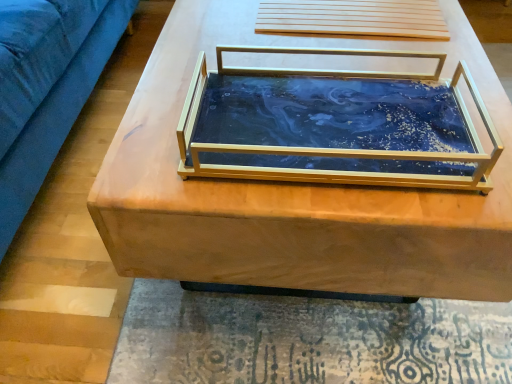
The width and height of the screenshot is (512, 384). Describe the element at coordinates (334, 125) in the screenshot. I see `marble-like blue tray at center` at that location.

Locate an element on the screen. The height and width of the screenshot is (384, 512). marble-like blue tray at center is located at coordinates (334, 125).

What do you see at coordinates (295, 190) in the screenshot?
I see `wooden table at center` at bounding box center [295, 190].

I want to click on wooden table at center, so click(x=295, y=190).

I want to click on marble-like blue tray at center, so coord(334,125).

Is wooden table at center at the right side of marble-like blue tray at center?

Correct, you'll find wooden table at center to the right of marble-like blue tray at center.

Considering the relative positions of wooden table at center and marble-like blue tray at center in the image provided, is wooden table at center behind marble-like blue tray at center?

That is True.

Does point (368, 249) lie in front of point (423, 94)?

Yes, point (368, 249) is in front of point (423, 94).

From the image's perspective, who appears lower, wooden table at center or marble-like blue tray at center?

marble-like blue tray at center appears lower in the image.

From a real-world perspective, is wooden table at center above or below marble-like blue tray at center?

wooden table at center is below marble-like blue tray at center.

Which object is thinner, wooden table at center or marble-like blue tray at center?

Thinner between the two is marble-like blue tray at center.

Which of these two, wooden table at center or marble-like blue tray at center, stands shorter?

marble-like blue tray at center.

Which of these two, wooden table at center or marble-like blue tray at center, is smaller?

With smaller size is marble-like blue tray at center.

Is wooden table at center spatially inside marble-like blue tray at center, or outside of it?

wooden table at center is not inside marble-like blue tray at center, it's outside.

Would you say wooden table at center is a long distance from marble-like blue tray at center?

No.

Is wooden table at center oriented towards marble-like blue tray at center?

No.

How different are the orientations of wooden table at center and marble-like blue tray at center in degrees?

The angle between the facing direction of wooden table at center and the facing direction of marble-like blue tray at center is 0.0014 degrees.

Find the location of `table above the marble-like blue tray at center (from the image's perspective)`. table above the marble-like blue tray at center (from the image's perspective) is located at coordinates (295, 190).

Visually, is marble-like blue tray at center positioned to the left or to the right of wooden table at center?

marble-like blue tray at center is to the left of wooden table at center.

Is the depth of marble-like blue tray at center less than that of wooden table at center?

Yes, it is.

Which is closer to the camera, (322, 73) or (184, 223)?

The point (184, 223) is more forward.

From the image's perspective, which one is positioned lower, marble-like blue tray at center or wooden table at center?

marble-like blue tray at center, from the image's perspective.

From a real-world perspective, which object stands above the other?

marble-like blue tray at center.

Between marble-like blue tray at center and wooden table at center, which one has smaller width?

marble-like blue tray at center.

Who is shorter, marble-like blue tray at center or wooden table at center?

marble-like blue tray at center.

Can you confirm if marble-like blue tray at center is bigger than wooden table at center?

No, marble-like blue tray at center is not bigger than wooden table at center.

Would you say marble-like blue tray at center is inside or outside wooden table at center?

marble-like blue tray at center lies outside wooden table at center.

Is marble-like blue tray at center next to wooden table at center?

Yes, the surface of marble-like blue tray at center is in contact with wooden table at center.

Is wooden table at center at the back of marble-like blue tray at center?

No, marble-like blue tray at center is not facing the opposite direction of wooden table at center.

Measure the distance from marble-like blue tray at center to wooden table at center.

The distance of marble-like blue tray at center from wooden table at center is 2.97 inches.

At what (x,y) coordinates should I click in order to perform the action: click on glass box in front of the wooden table at center. Please return your answer as a coordinate pair (x, y). Image resolution: width=512 pixels, height=384 pixels. Looking at the image, I should click on (334, 125).

This screenshot has width=512, height=384. I want to click on table behind the marble-like blue tray at center, so click(x=295, y=190).

Identify the location of table on the right of marble-like blue tray at center. (295, 190).